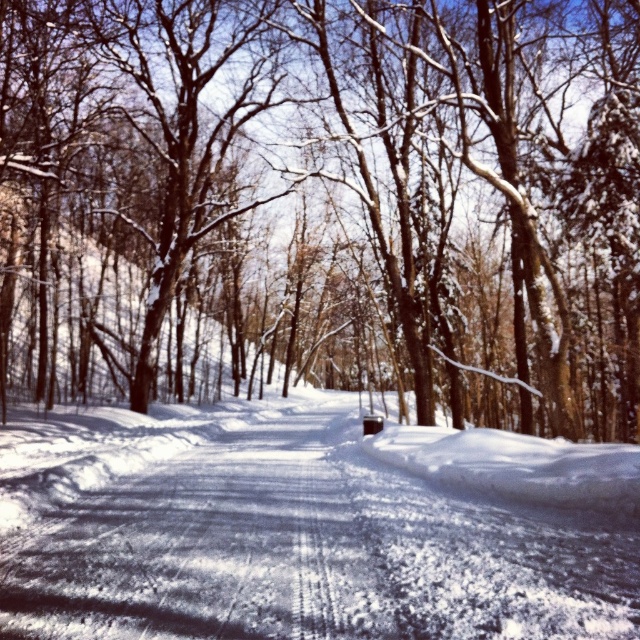
Which of these two, snow-covered tree at center or white powdery snow at center, stands taller?

Standing taller between the two is snow-covered tree at center.

Describe the element at coordinates (324, 202) in the screenshot. The image size is (640, 640). I see `snow-covered tree at center` at that location.

The height and width of the screenshot is (640, 640). I want to click on snow-covered tree at center, so click(324, 202).